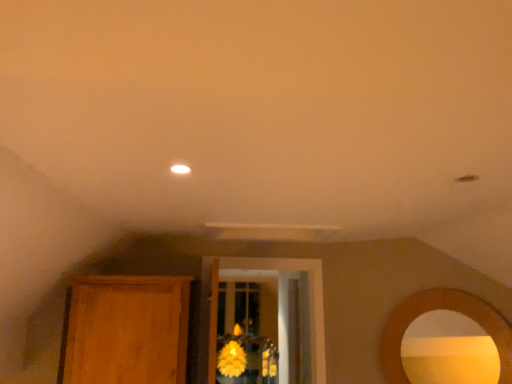
Question: Is there a large distance between matte gold mirror at right and wooden armoire at left?

Choices:
 (A) no
 (B) yes

Answer: (B)

Question: Is matte gold mirror at right next to wooden armoire at left and touching it?

Choices:
 (A) yes
 (B) no

Answer: (B)

Question: From a real-world perspective, is matte gold mirror at right located beneath wooden armoire at left?

Choices:
 (A) yes
 (B) no

Answer: (A)

Question: Is matte gold mirror at right wider than wooden armoire at left?

Choices:
 (A) yes
 (B) no

Answer: (B)

Question: Does matte gold mirror at right have a lesser height compared to wooden armoire at left?

Choices:
 (A) no
 (B) yes

Answer: (B)

Question: In the image, is matte gold mirror at right positioned in front of or behind yellow matte flower at center?

Choices:
 (A) front
 (B) behind

Answer: (A)

Question: In terms of width, does matte gold mirror at right look wider or thinner when compared to yellow matte flower at center?

Choices:
 (A) wide
 (B) thin

Answer: (B)

Question: Looking at the image, does matte gold mirror at right seem bigger or smaller compared to yellow matte flower at center?

Choices:
 (A) big
 (B) small

Answer: (B)

Question: From a real-world perspective, relative to yellow matte flower at center, is matte gold mirror at right vertically above or below?

Choices:
 (A) above
 (B) below

Answer: (A)

Question: From the image's perspective, is yellow matte flower at center located above or below wooden armoire at left?

Choices:
 (A) above
 (B) below

Answer: (B)

Question: Considering the positions of yellow matte flower at center and wooden armoire at left in the image, is yellow matte flower at center wider or thinner than wooden armoire at left?

Choices:
 (A) thin
 (B) wide

Answer: (A)

Question: Based on their sizes in the image, would you say yellow matte flower at center is bigger or smaller than wooden armoire at left?

Choices:
 (A) big
 (B) small

Answer: (B)

Question: From their relative heights in the image, would you say yellow matte flower at center is taller or shorter than wooden armoire at left?

Choices:
 (A) tall
 (B) short

Answer: (A)

Question: Considering the positions of wooden armoire at left and matte gold mirror at right in the image, is wooden armoire at left bigger or smaller than matte gold mirror at right?

Choices:
 (A) big
 (B) small

Answer: (A)

Question: Considering the relative positions of wooden armoire at left and matte gold mirror at right in the image provided, is wooden armoire at left to the left or to the right of matte gold mirror at right?

Choices:
 (A) right
 (B) left

Answer: (B)